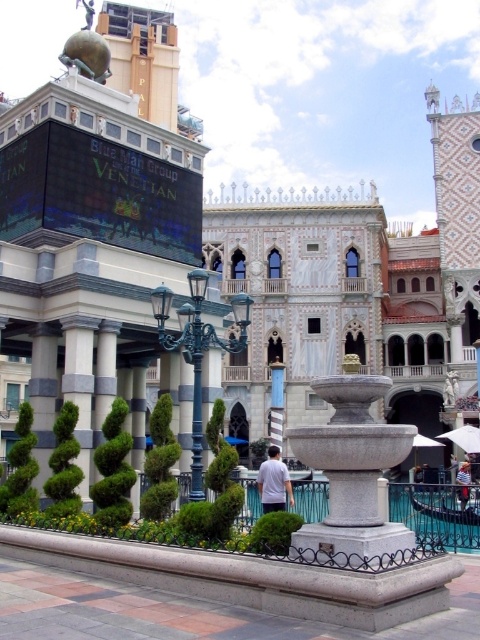
Question: Among these points, which one is nearest to the camera?

Choices:
 (A) pyautogui.click(x=464, y=435)
 (B) pyautogui.click(x=345, y=522)

Answer: (B)

Question: Which point is farther from the camera taking this photo?

Choices:
 (A) (359, 481)
 (B) (467, 465)

Answer: (B)

Question: Which point appears farthest from the camera in this image?

Choices:
 (A) (286, 488)
 (B) (468, 467)

Answer: (B)

Question: Can you confirm if granite fountain at center is positioned to the right of white cotton shirt at center?

Choices:
 (A) no
 (B) yes

Answer: (B)

Question: Can you confirm if granite fountain at center is positioned above white fabric umbrella at center?

Choices:
 (A) no
 (B) yes

Answer: (B)

Question: Can you confirm if granite fountain at center is smaller than white striped shirt at center?

Choices:
 (A) no
 (B) yes

Answer: (B)